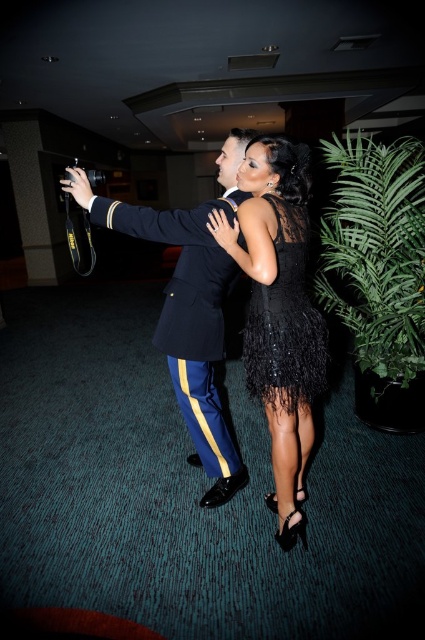
Consider the image. Measure the distance between black sequined dress at center and camera.

The distance of black sequined dress at center from camera is 5.28 feet.

Is black sequined dress at center below navy blue fabric uniform at center?

Actually, black sequined dress at center is above navy blue fabric uniform at center.

This screenshot has width=425, height=640. What do you see at coordinates (278, 310) in the screenshot?
I see `black sequined dress at center` at bounding box center [278, 310].

Locate an element on the screen. The image size is (425, 640). black sequined dress at center is located at coordinates (278, 310).

Is shiny black dress at center bigger than black sequined dress at center?

Yes.

Who is more forward, [223,252] or [243,227]?

Positioned in front is point [243,227].

Find the location of a particular element. The image size is (425, 640). shiny black dress at center is located at coordinates (223, 298).

Is black sequined dress at center positioned in front of black feathered dress at center?

Yes, black sequined dress at center is closer to the viewer.

Measure the distance between black sequined dress at center and camera.

black sequined dress at center is 5.28 feet away from camera.

This screenshot has height=640, width=425. I want to click on black sequined dress at center, so (278, 310).